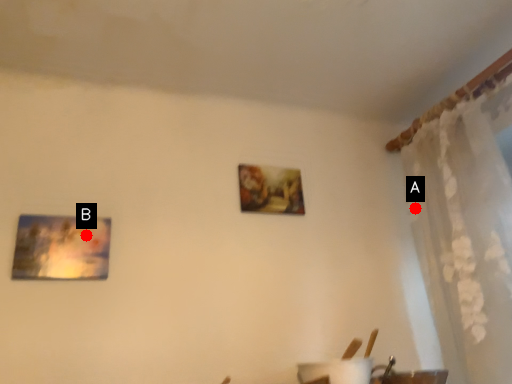
Question: Two points are circled on the image, labeled by A and B beside each circle. Among these points, which one is nearest to the camera?

Choices:
 (A) A is closer
 (B) B is closer

Answer: (B)